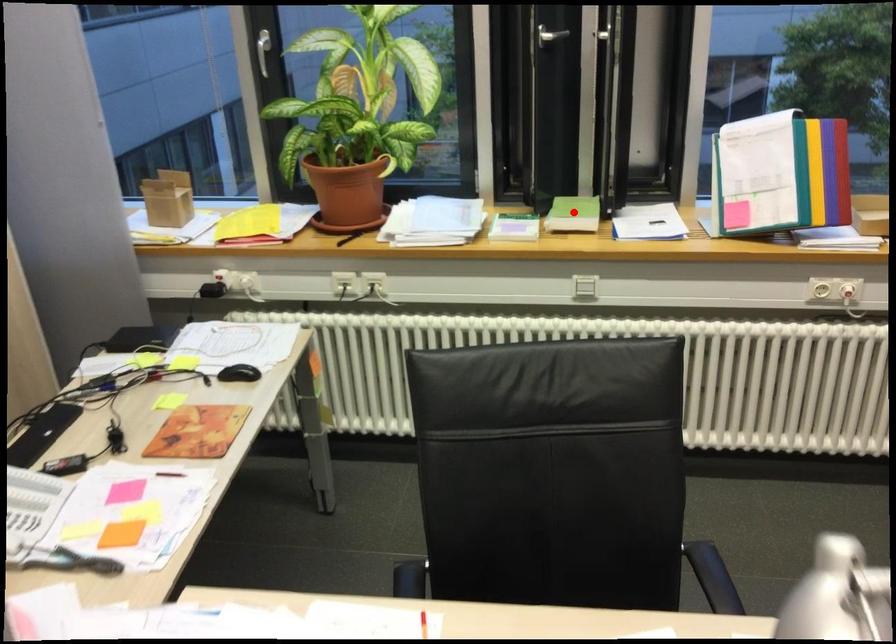
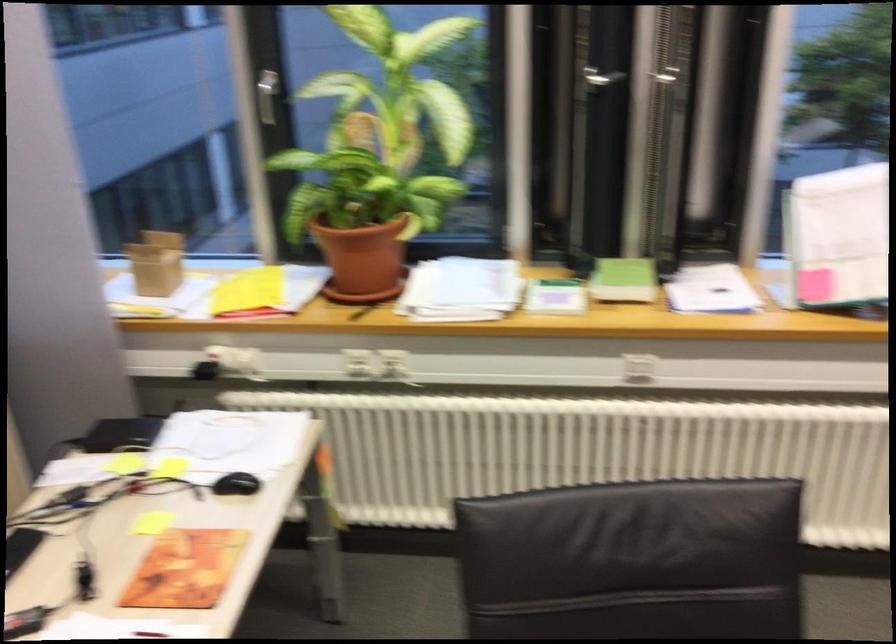
Question: I am providing you with two images of the same scene from different viewpoints. A red point is shown in image1. For the corresponding object point in image2, is it positioned nearer or farther from the camera?

Choices:
 (A) Nearer
 (B) Farther

Answer: (A)